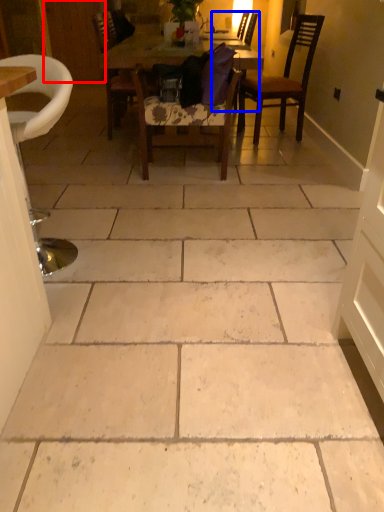
Question: Which point is further to the camera, door (highlighted by a red box) or chair (highlighted by a blue box)?

Choices:
 (A) door
 (B) chair

Answer: (A)